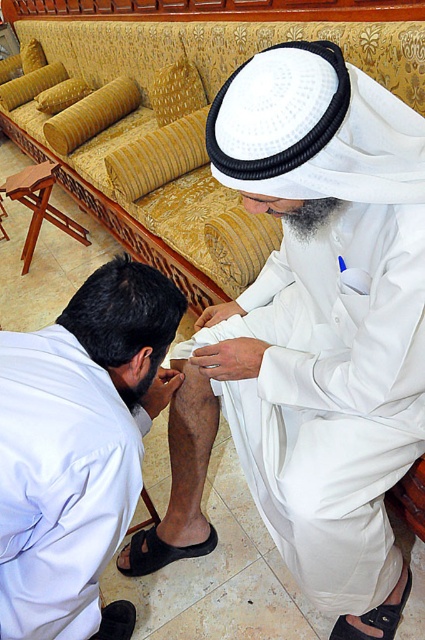
You are a photographer standing in the scene. You want to take a closeup photo of the point at coordinate point (x=48, y=604). The camera can only focus on objects within 90 centimeters. Will the camera be able to focus on that point?

The distance of point (x=48, y=604) from camera is 87.66 centimeters, which is within the 90 centimeter range. Therefore, the camera can focus on that point.

You are a photographer setting up a shoot in this scene. You need to place a small prop on the white matte shirt at lower left and another prop on the black suede sandal at lower center. Which prop placement will be higher from the ground?

The white matte shirt at lower left is located above the black suede sandal at lower center, so placing a prop on the white matte shirt at lower left will be higher from the ground.

You are a tailor who needs to determine which item, the white matte cloth at center or the white matte shirt at lower left, is wider. Based on the scene, which one is wider?

The white matte cloth at center is wider than the white matte shirt at lower left according to the description.